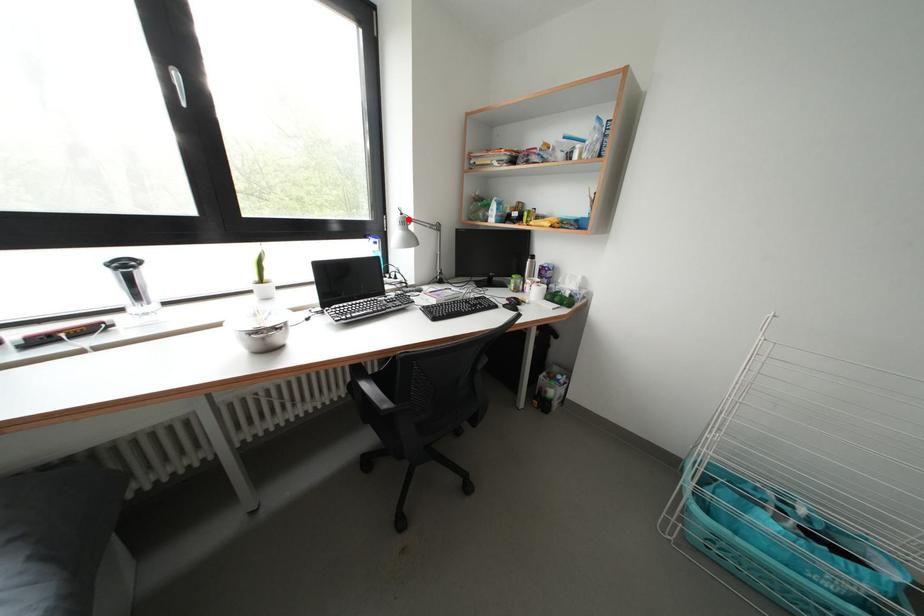
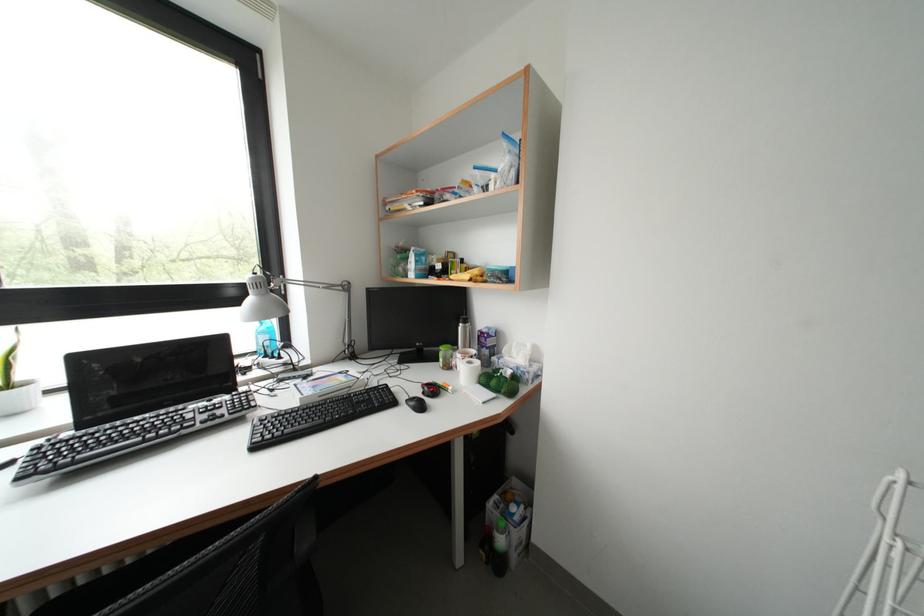
Question: I am providing you with two images of the same scene from different viewpoints. In image1, a red point is highlighted. Considering the same 3D point in image2, which of the following is correct?

Choices:
 (A) It is closer
 (B) It is farther

Answer: (B)